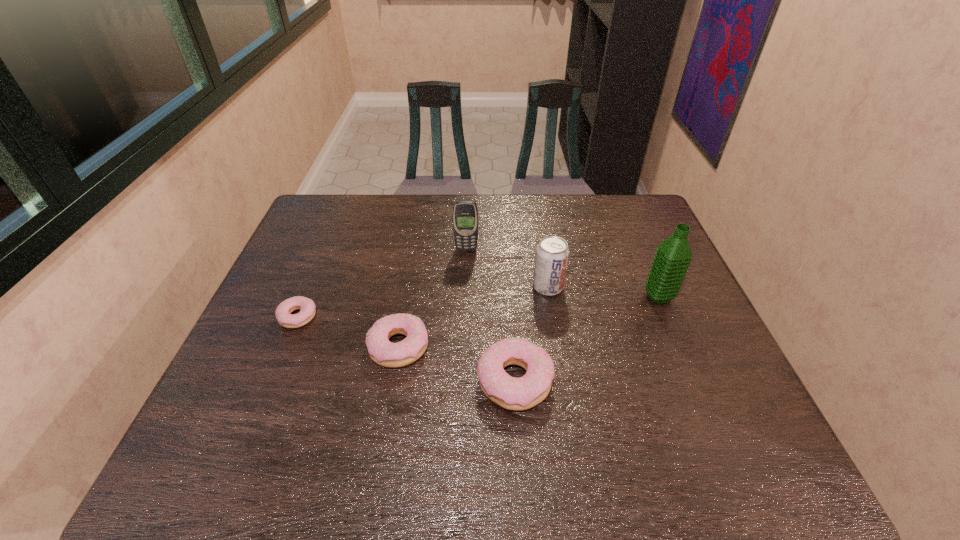
Image resolution: width=960 pixels, height=540 pixels. In order to click on free space that satisfies the following two spatial constraints: 1. on the screen of the farthest object; 2. on the right side of the third tallest object in this screenshot , I will do `click(465, 287)`.

At what (x,y) coordinates should I click in order to perform the action: click on free spot that satisfies the following two spatial constraints: 1. on the screen of the rightmost doughnut; 2. on the left side of the cellular telephone. Please return your answer as a coordinate pair (x, y). Looking at the image, I should click on (462, 380).

The width and height of the screenshot is (960, 540). Find the location of `vacant space that satisfies the following two spatial constraints: 1. on the screen of the farthest object; 2. on the left side of the fourth shortest object`. vacant space that satisfies the following two spatial constraints: 1. on the screen of the farthest object; 2. on the left side of the fourth shortest object is located at coordinates (465, 287).